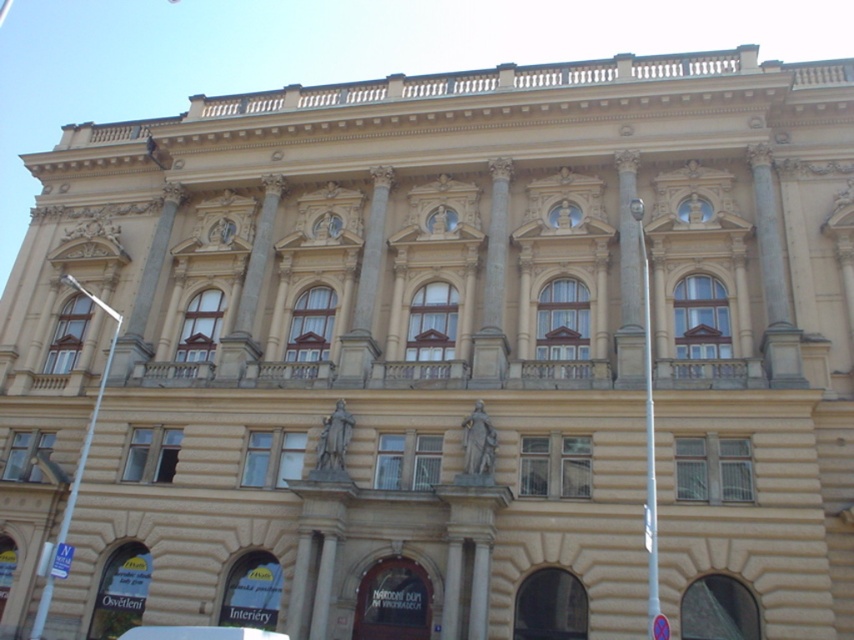
You are an architect examining the building facade. You notice the white marble pillar at center and the beige stone pillar at center. Which pillar is located higher up on the facade?

The white marble pillar at center is positioned over the beige stone pillar at center, so it is higher up.

You are standing in front of the grand classical building and notice a metallic silver car at lower center. Based on its position, can you determine if the car is closer to the entrance of the building or the decorative balustrades on the roofline?

The metallic silver car at lower center is located at point coordinates that place it closer to the entrance of the building rather than the decorative balustrades on the roofline.

You are standing in front of the grand classical building and see the metallic silver car at lower center and the beige stone column at center. Which object is closer to the ground?

The metallic silver car at lower center is closer to the ground because it is positioned below the beige stone column at center.